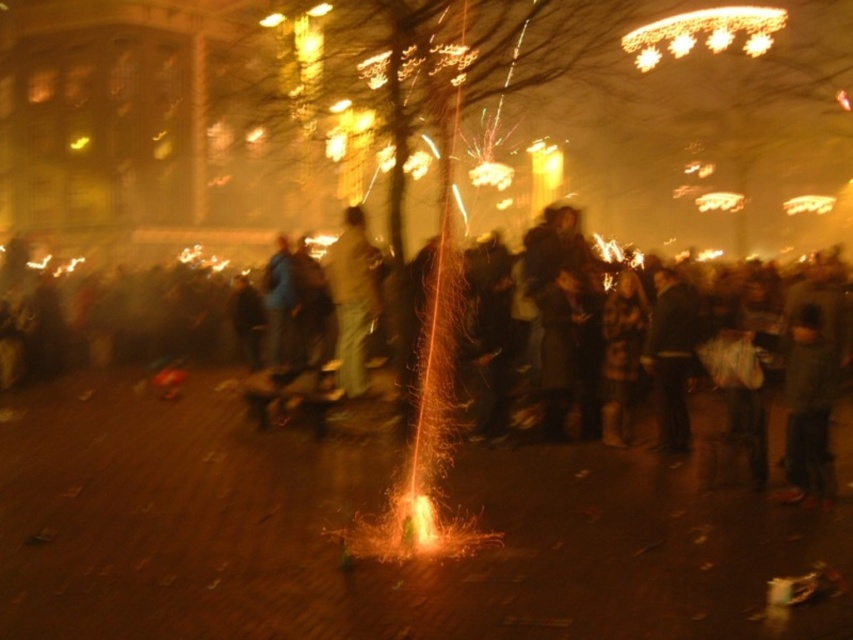
Question: Considering the relative positions of dark clothing crowd at center and dark gray sweater at center in the image provided, where is dark clothing crowd at center located with respect to dark gray sweater at center?

Choices:
 (A) above
 (B) below

Answer: (A)

Question: Observing the image, what is the correct spatial positioning of dark clothing crowd at center in reference to dark gray sweater at center?

Choices:
 (A) below
 (B) above

Answer: (B)

Question: Which point appears closest to the camera in this image?

Choices:
 (A) (680, 420)
 (B) (364, 256)

Answer: (A)

Question: Among these objects, which one is nearest to the camera?

Choices:
 (A) dark clothing crowd at center
 (B) dark gray sweater at center

Answer: (A)

Question: Which of the following is the farthest from the observer?

Choices:
 (A) (750, 429)
 (B) (367, 301)

Answer: (B)

Question: In this image, where is dark gray sweater at center located relative to light brown leather jacket at center?

Choices:
 (A) below
 (B) above

Answer: (A)